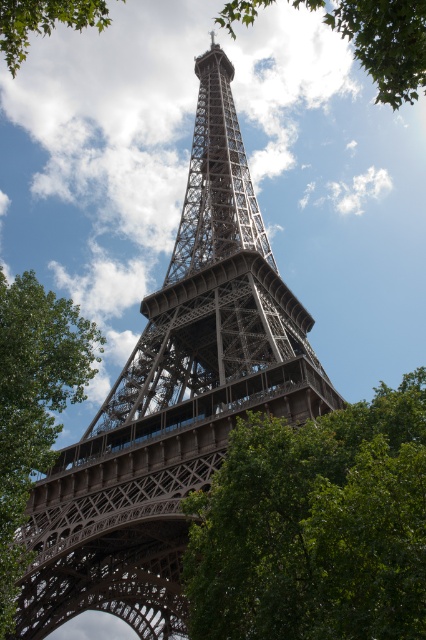
You are a tourist standing at the base of the Eiffel Tower and notice two green leafy trees in the scene. Which tree, the green leafy tree at lower center or the green leafy tree at left, is closer to you?

The green leafy tree at lower center is closer to you because it is in front of the green leafy tree at left.

From the picture: You are a tourist standing at the base of the Eiffel Tower and see the green leafy tree at lower center and the green leafy tree at left in the foreground. Which tree appears closer to you?

The green leafy tree at lower center appears closer because it is smaller than the green leafy tree at left, indicating it is farther away due to perspective.

You are standing at the base of the Eiffel Tower and want to take a photo. You notice two points marked on your map at coordinates point (215, 17) and point (108, 22). According to the scene description, which point is closer to you when facing the Eiffel Tower?

Point (108, 22) is closer to you because it is in front of point (215, 17).